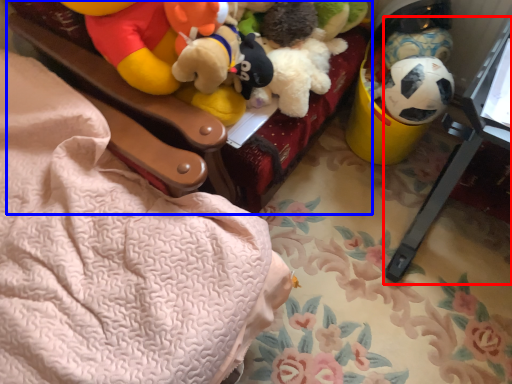
Question: Among these objects, which one is farthest to the camera, changing table (highlighted by a red box) or furniture (highlighted by a blue box)?

Choices:
 (A) changing table
 (B) furniture

Answer: (B)